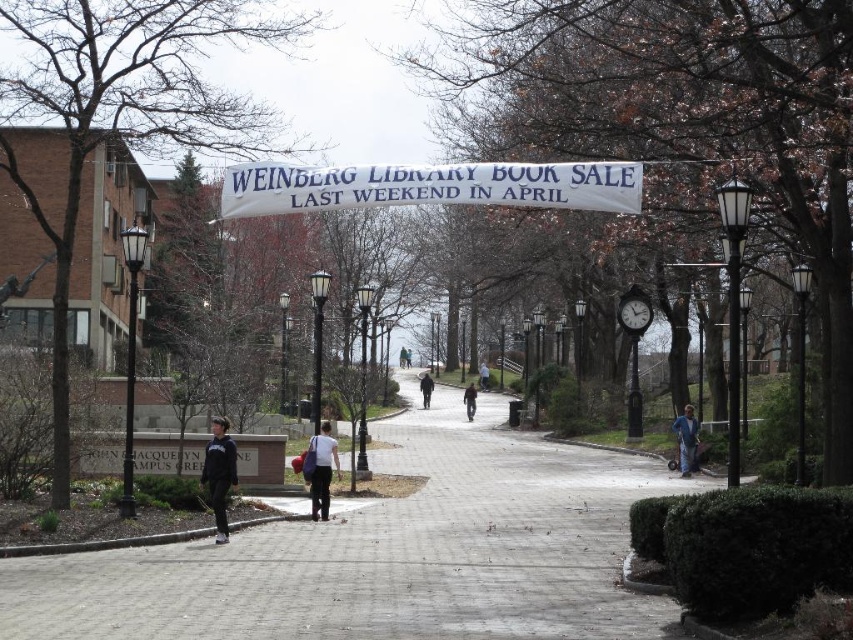
Image resolution: width=853 pixels, height=640 pixels. What do you see at coordinates (430, 186) in the screenshot? I see `white fabric banner at center` at bounding box center [430, 186].

Between point (463, 193) and point (328, 468), which one is positioned in front?

Point (463, 193)

This screenshot has height=640, width=853. What are the coordinates of `white fabric banner at center` in the screenshot? It's located at (430, 186).

From the picture: Does white fabric banner at center have a lesser width compared to metallic gray clock at center?

No.

How much distance is there between white fabric banner at center and metallic gray clock at center?

A distance of 74.51 feet exists between white fabric banner at center and metallic gray clock at center.

Does point (508, 188) lie in front of point (630, 305)?

Yes, it is in front of point (630, 305).

Identify the location of white fabric banner at center. This screenshot has height=640, width=853. (430, 186).

Can you confirm if blue denim jacket at lower right is bigger than dark blue jacket at center?

No, blue denim jacket at lower right is not bigger than dark blue jacket at center.

Is blue denim jacket at lower right behind dark blue jacket at center?

That is False.

This screenshot has width=853, height=640. Identify the location of blue denim jacket at lower right. (685, 440).